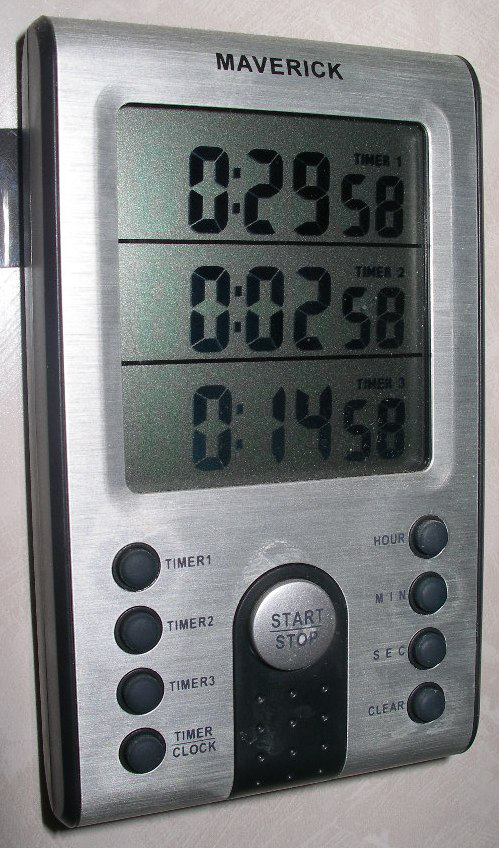
The image size is (499, 848). Find the location of `faceplate of timer`. faceplate of timer is located at coordinates (302, 525).